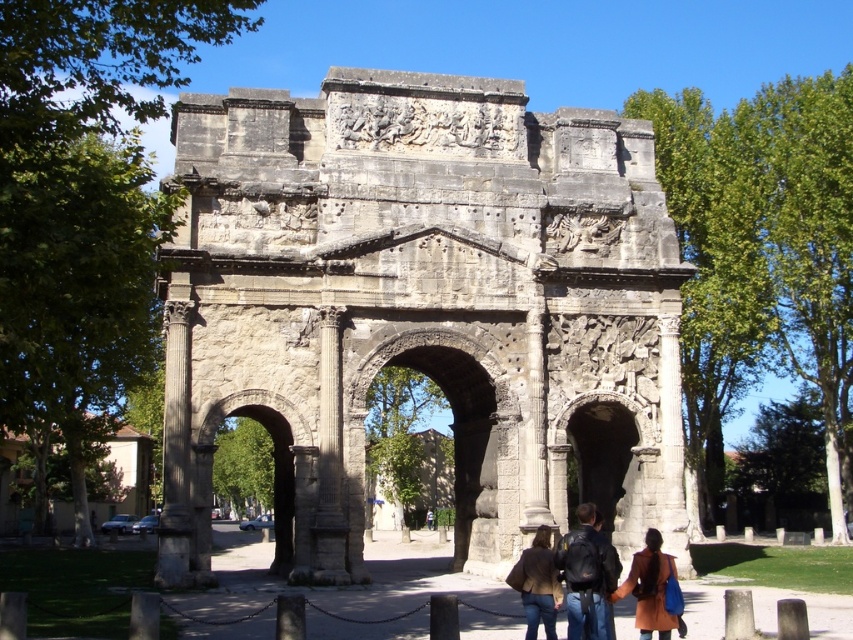
You are a visitor at the park and see the gray stone column at left and the olive brown leather coat at center. Which object is taller?

The gray stone column at left is much taller than the olive brown leather coat at center.